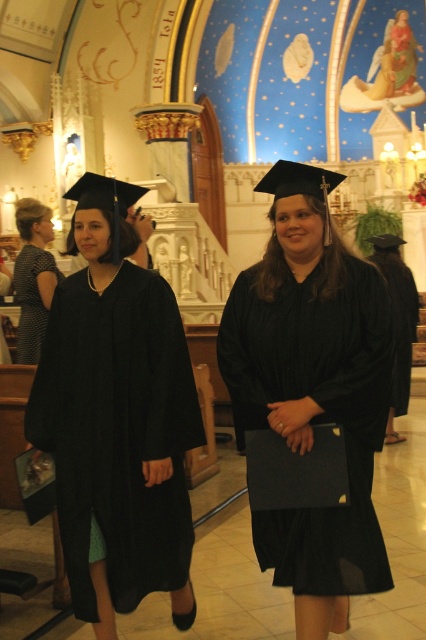
Is matte black graduation gown at center bigger than matte black dress at left?

Actually, matte black graduation gown at center might be smaller than matte black dress at left.

Is matte black graduation gown at center smaller than matte black dress at left?

Indeed, matte black graduation gown at center has a smaller size compared to matte black dress at left.

Is point (275, 250) closer to viewer compared to point (49, 291)?

Yes, it is.

This screenshot has height=640, width=426. What are the coordinates of `matte black graduation gown at center` in the screenshot? It's located at (313, 390).

Does matte black gown at center have a larger size compared to matte black graduation gown at center?

Actually, matte black gown at center might be smaller than matte black graduation gown at center.

Between matte black gown at center and matte black graduation gown at center, which one appears on the left side from the viewer's perspective?

From the viewer's perspective, matte black gown at center appears more on the left side.

What do you see at coordinates (117, 419) in the screenshot?
I see `matte black gown at center` at bounding box center [117, 419].

Locate an element on the screen. The width and height of the screenshot is (426, 640). matte black gown at center is located at coordinates (117, 419).

Is the position of matte black gown at center less distant than that of matte black dress at left?

Yes, matte black gown at center is closer to the viewer.

Which is more to the left, matte black gown at center or matte black dress at left?

From the viewer's perspective, matte black dress at left appears more on the left side.

The height and width of the screenshot is (640, 426). I want to click on matte black gown at center, so click(117, 419).

This screenshot has height=640, width=426. In order to click on matte black gown at center in this screenshot , I will do `click(117, 419)`.